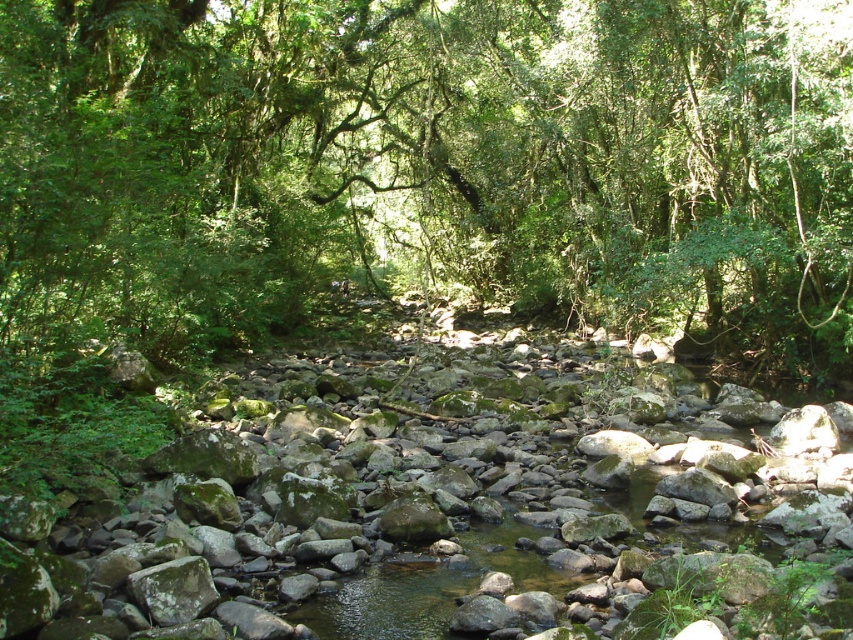
Is point (583, 291) less distant than point (347, 467)?

That is False.

Can you confirm if green leafy tree at center is wider than green mossy rock at center?

Correct, the width of green leafy tree at center exceeds that of green mossy rock at center.

Is point (137, 326) more distant than point (680, 472)?

Yes, point (137, 326) is farther from viewer.

Where is `green leafy tree at center`? green leafy tree at center is located at coordinates (428, 164).